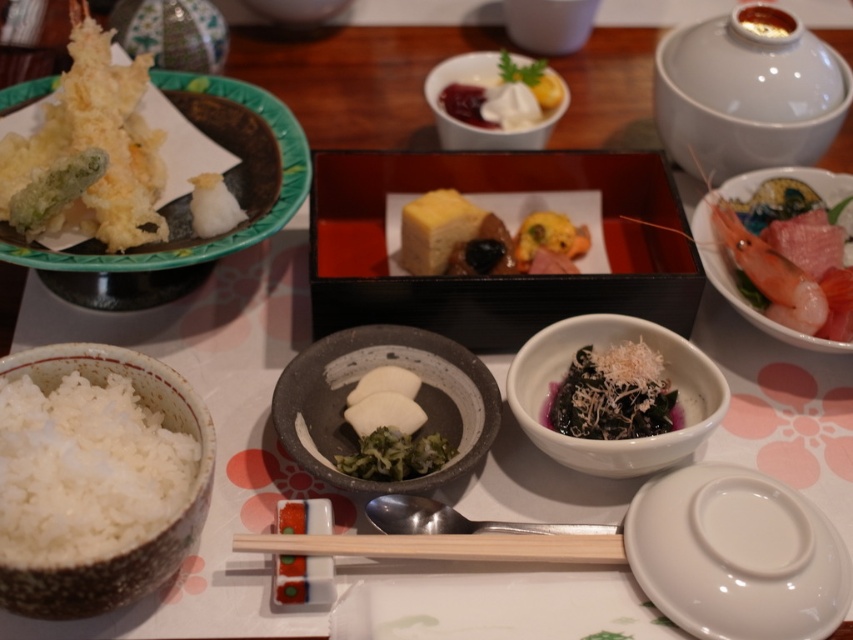
Question: Among these points, which one is nearest to the camera?

Choices:
 (A) (663, 355)
 (B) (318, 296)

Answer: (B)

Question: Which point is closer to the camera taking this photo?

Choices:
 (A) (233, 225)
 (B) (838, 593)
 (C) (328, 566)

Answer: (B)

Question: Can you confirm if golden crispy tempura at left is positioned to the left of white ceramic bowl at upper center?

Choices:
 (A) no
 (B) yes

Answer: (B)

Question: Which of these objects is positioned closest to the white ceramic bowl at upper center?

Choices:
 (A) dark green leafy vegetable with shredded topping at center
 (B) black lacquered tray at center
 (C) yellow cheese at center
 (D) white glossy plate at lower right

Answer: (C)

Question: Is white ceramic bowl at upper center closer to camera compared to white fluffy rice at upper left?

Choices:
 (A) yes
 (B) no

Answer: (B)

Question: Can you confirm if golden crispy tempura at left is bigger than pink glossy shrimp at right?

Choices:
 (A) no
 (B) yes

Answer: (B)